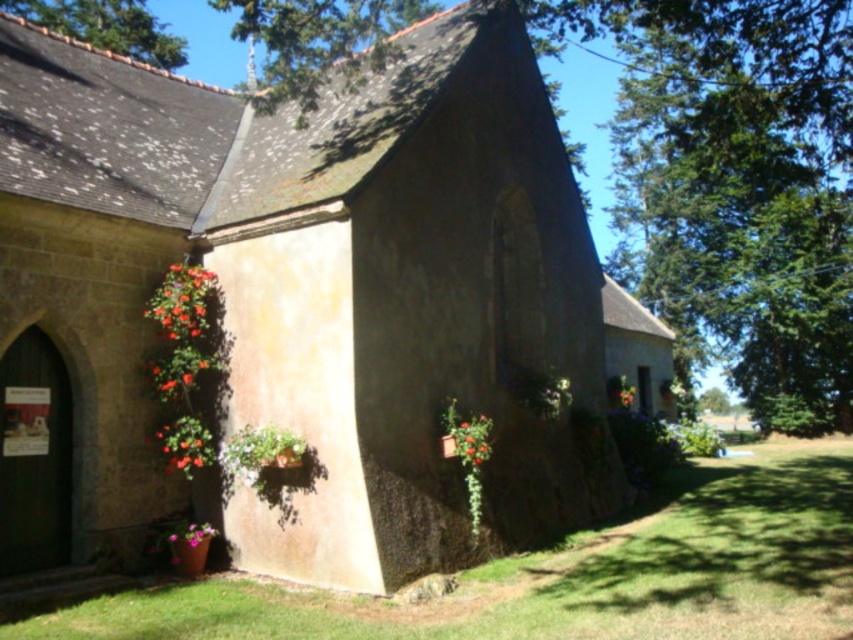
You are standing at the point marked as point (161, 314) in the image. The camera is positioned 10.14 meters away from you. If you want to take a photo of the chapel from this position, will you be able to capture the entire building in one frame without moving?

The camera is positioned 10.14 meters away from point (161, 314). Since the camera is at that distance, you might need to adjust your position or use a wider lens to ensure the entire chapel is in frame, as the distance could affect the field of view required to capture the entire structure.